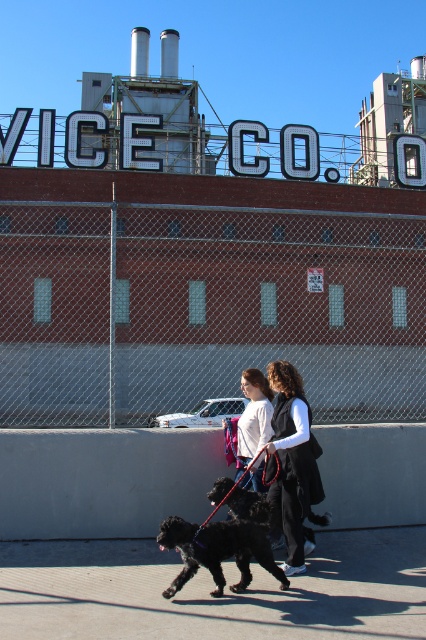
Based on the photo, is smooth concrete sidewalk at lower center to the right of shiny black dog at center from the viewer's perspective?

In fact, smooth concrete sidewalk at lower center is to the left of shiny black dog at center.

Which is behind, point (143, 618) or point (242, 544)?

Point (242, 544)

This screenshot has width=426, height=640. In order to click on smooth concrete sidewalk at lower center in this screenshot , I will do [x=210, y=589].

Is black fabric vest at center to the right of white matte shirt at center from the viewer's perspective?

Indeed, black fabric vest at center is positioned on the right side of white matte shirt at center.

This screenshot has width=426, height=640. I want to click on black fabric vest at center, so click(x=293, y=461).

Based on the photo, which is more to the left, black fabric vest at center or black silky dog at center?

From the viewer's perspective, black silky dog at center appears more on the left side.

Based on the photo, does black fabric vest at center appear on the left side of black silky dog at center?

In fact, black fabric vest at center is to the right of black silky dog at center.

Identify the location of black fabric vest at center. This screenshot has height=640, width=426. (293, 461).